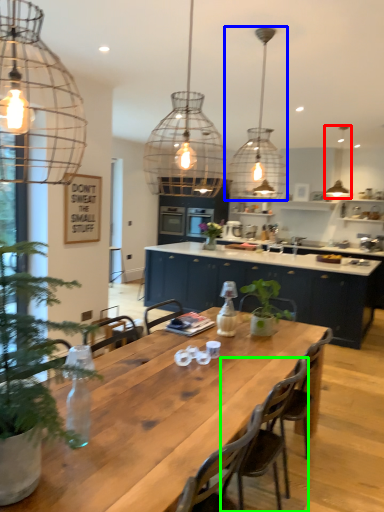
Question: Considering the real-world distances, which object is farthest from lamp (highlighted by a red box)? lamp (highlighted by a blue box) or chair (highlighted by a green box)?

Choices:
 (A) lamp
 (B) chair

Answer: (B)